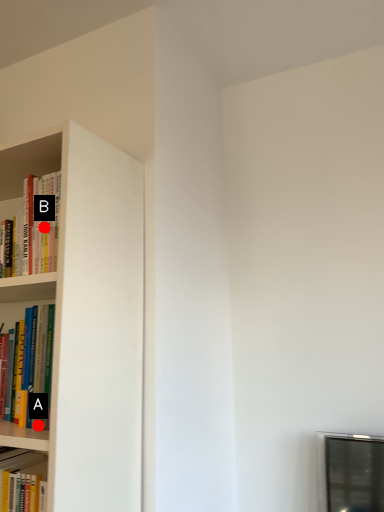
Question: Two points are circled on the image, labeled by A and B beside each circle. Which point appears closest to the camera in this image?

Choices:
 (A) A is closer
 (B) B is closer

Answer: (A)